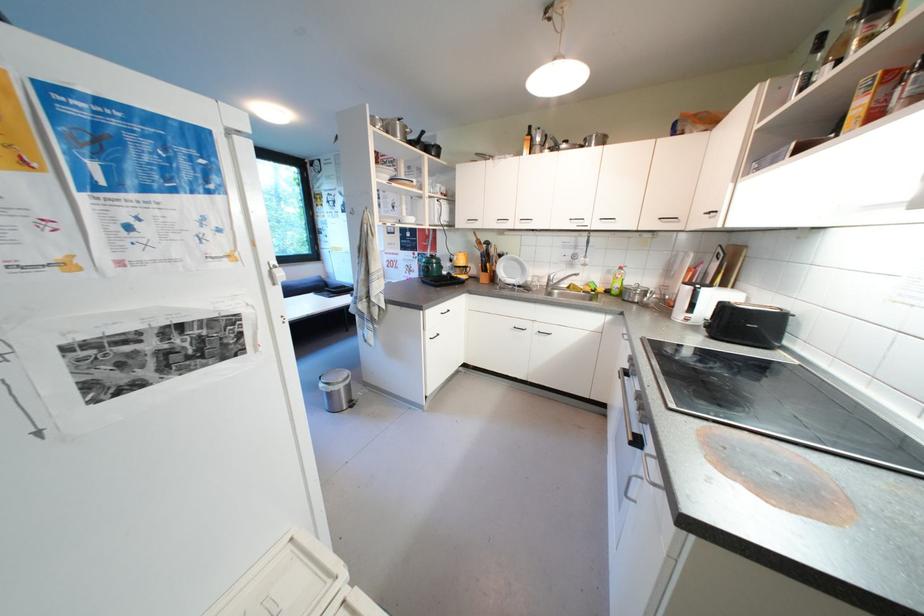
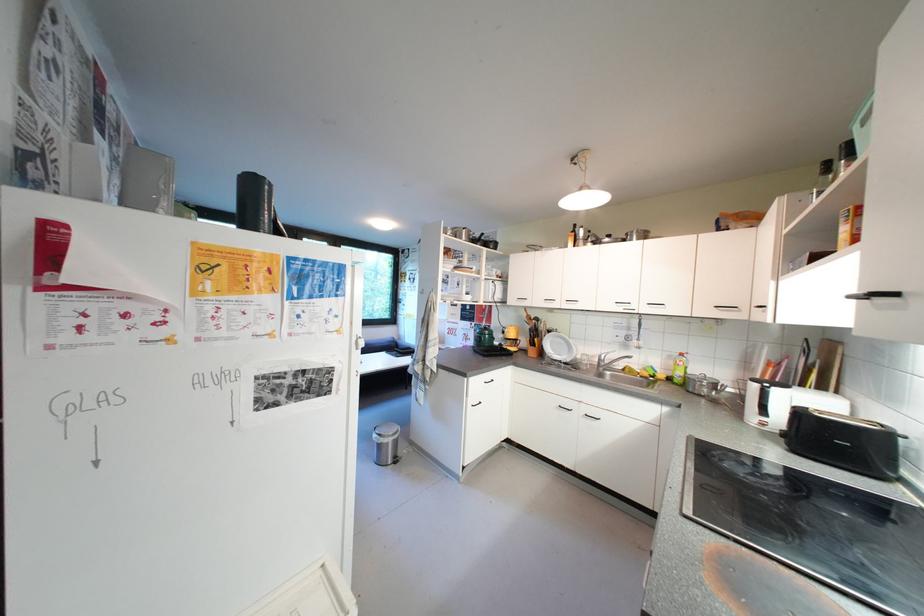
Locate, in the second image, the point that corresponds to pixel 550 280 in the first image.

(602, 359)